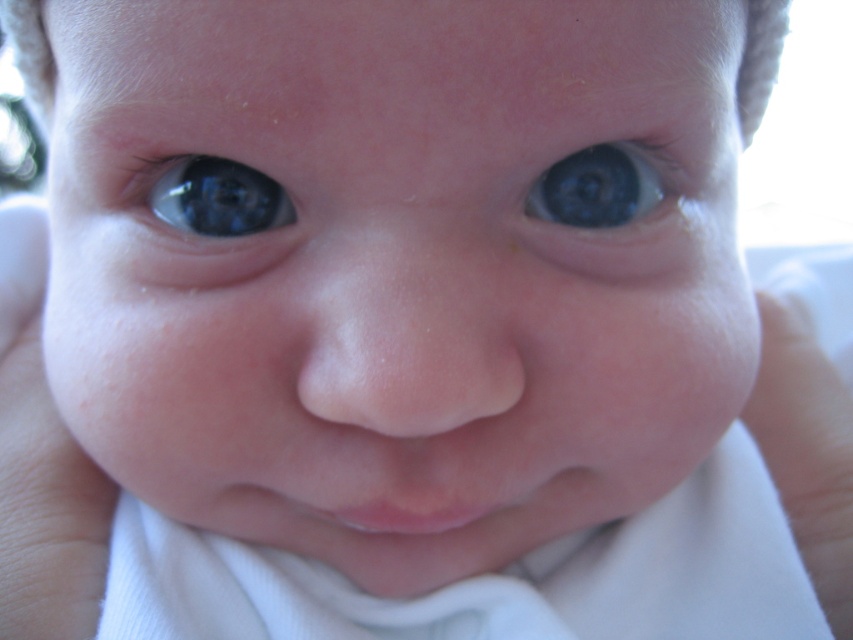
Is white soft skin at lower left taller than blue glossy eye at upper left?

Yes.

Is white soft skin at lower left thinner than blue glossy eye at upper left?

Incorrect, white soft skin at lower left's width is not less than blue glossy eye at upper left's.

The image size is (853, 640). Find the location of `white soft skin at lower left`. white soft skin at lower left is located at coordinates (41, 465).

In order to click on white soft skin at lower left in this screenshot , I will do `click(41, 465)`.

Is white soft skin at lower left wider than white fabric at lower right?

Correct, the width of white soft skin at lower left exceeds that of white fabric at lower right.

Does white soft skin at lower left appear under white fabric at lower right?

No.

Between point (24, 625) and point (815, 385), which one is positioned behind?

The point (815, 385) is more distant.

You are a GUI agent. You are given a task and a screenshot of the screen. Output one action in this format:
    pyautogui.click(x=<x>, y=<y>)
    Task: Click on the white soft skin at lower left
    The image size is (853, 640).
    Given the screenshot: What is the action you would take?
    pyautogui.click(x=41, y=465)

Is point (782, 342) positioned in front of point (172, 198)?

No, (782, 342) is further to viewer.

How distant is white fabric at lower right from blue glossy eye at upper left?

They are 11.03 inches apart.

Locate an element on the screen. This screenshot has height=640, width=853. white fabric at lower right is located at coordinates (805, 448).

Locate an element on the screen. white fabric at lower right is located at coordinates (805, 448).